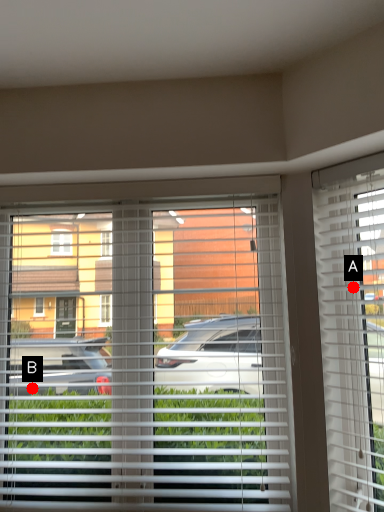
Question: Two points are circled on the image, labeled by A and B beside each circle. Which point is closer to the camera?

Choices:
 (A) A is closer
 (B) B is closer

Answer: (A)